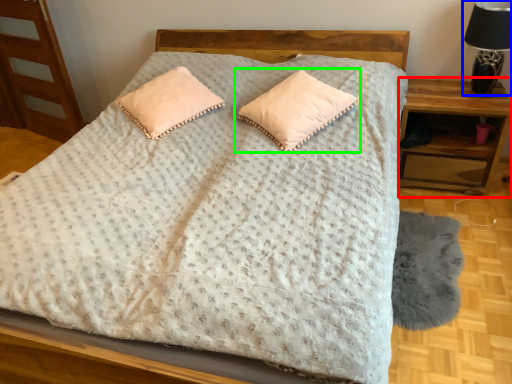
Question: Which is nearer to the nightstand (highlighted by a red box)? table lamp (highlighted by a blue box) or pillow (highlighted by a green box).

Choices:
 (A) table lamp
 (B) pillow

Answer: (A)